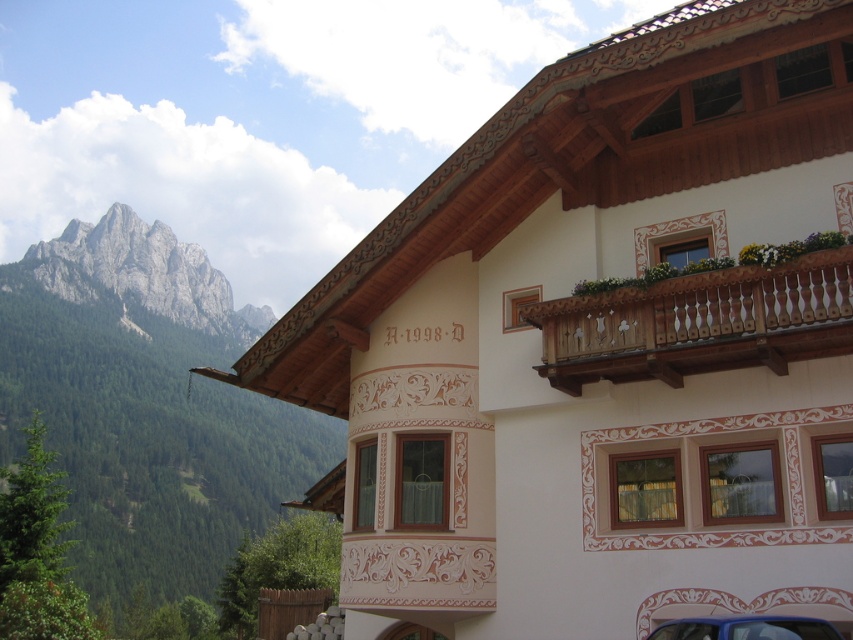
You are standing in front of the traditional European building and want to take a photo that includes both the building and the rugged stone mountain at left. If your camera can focus on objects up to 100 meters away, will the mountain be in focus?

The rugged stone mountain at left is 81.08 meters away from the camera. Since your camera can focus up to 100 meters, the mountain will be in focus.

You are a photographer planning to capture the gray rocky mountain at upper left and the blue glossy car at lower right in a single frame. Based on their sizes in the image, which object should you focus on first if you want both to be in focus?

The gray rocky mountain at upper left might be wider than the blue glossy car at lower right, so focusing on the wider object first would ensure both are in focus.

You are a photographer planning to capture the traditional European building and its surroundings. You notice the wooden at upper right and the blue glossy car at lower right in your frame. Based on their sizes in the image, which object would you need to position closer to the camera to ensure both occupy similar visual space?

The wooden at upper right is wider than the blue glossy car at lower right. To balance their visual space, you should move the blue glossy car at lower right closer to the camera since it is narrower and needs to appear larger in the frame.